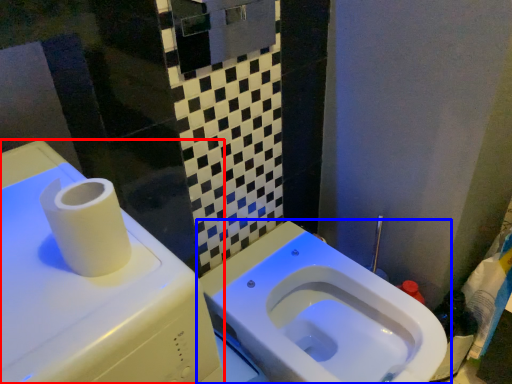
Question: Which of the following is the closest to the observer, water tank (highlighted by a red box) or toilet (highlighted by a blue box)?

Choices:
 (A) water tank
 (B) toilet

Answer: (A)